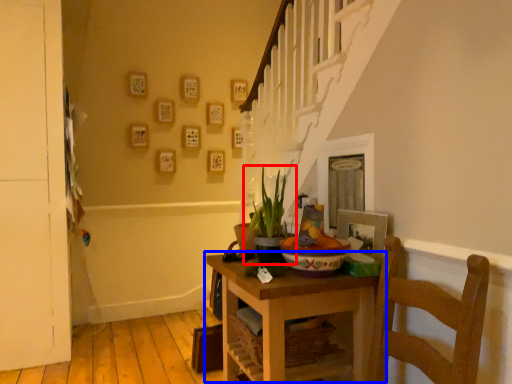
Question: Among these objects, which one is nearest to the camera, houseplant (highlighted by a red box) or table (highlighted by a blue box)?

Choices:
 (A) houseplant
 (B) table

Answer: (B)